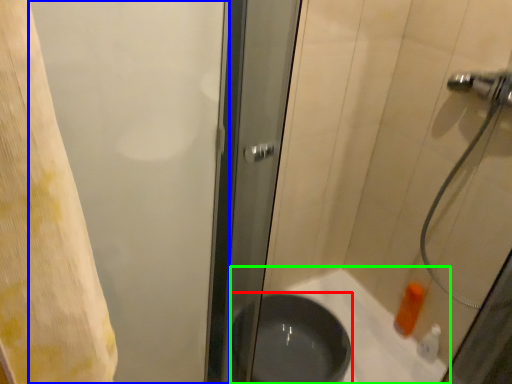
Question: Which object is positioned closest to basin (highlighted by a red box)? Select from screen door (highlighted by a blue box) and bath (highlighted by a green box).

Choices:
 (A) screen door
 (B) bath

Answer: (B)